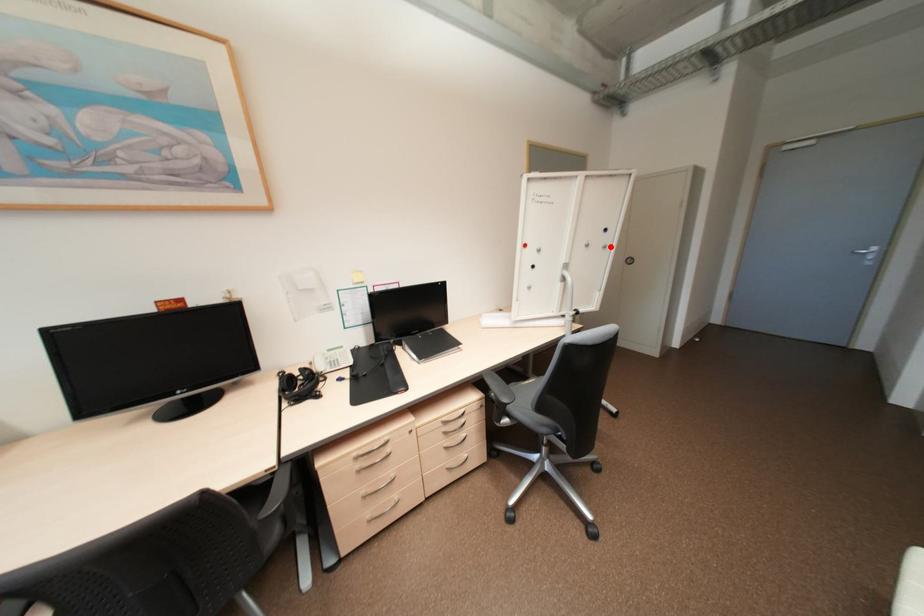
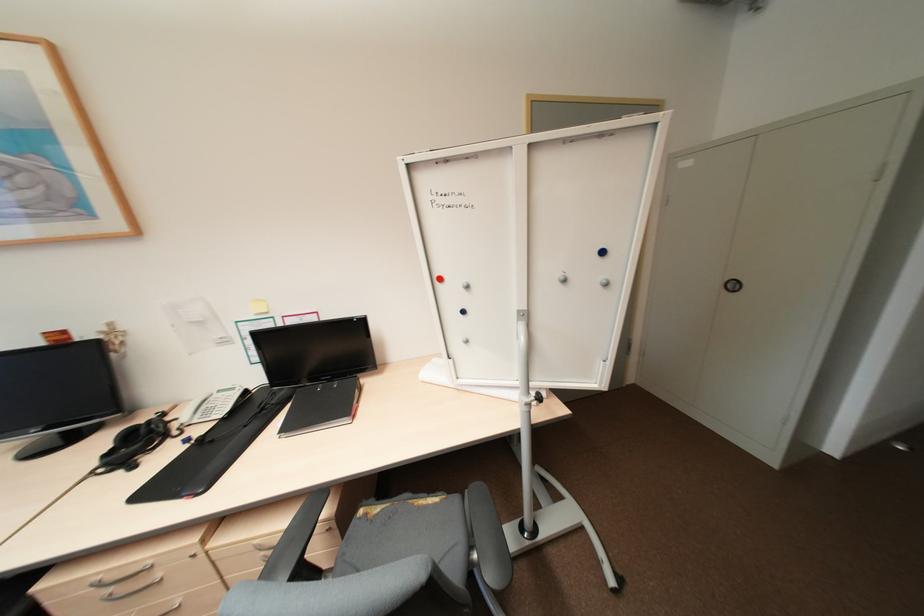
Question: A red point is marked in image1. In image2, is the corresponding 3D point closer to the camera or farther? Reply with the corresponding letter.

Choices:
 (A) The corresponding 3D point is closer.
 (B) The corresponding 3D point is farther.

Answer: (B)